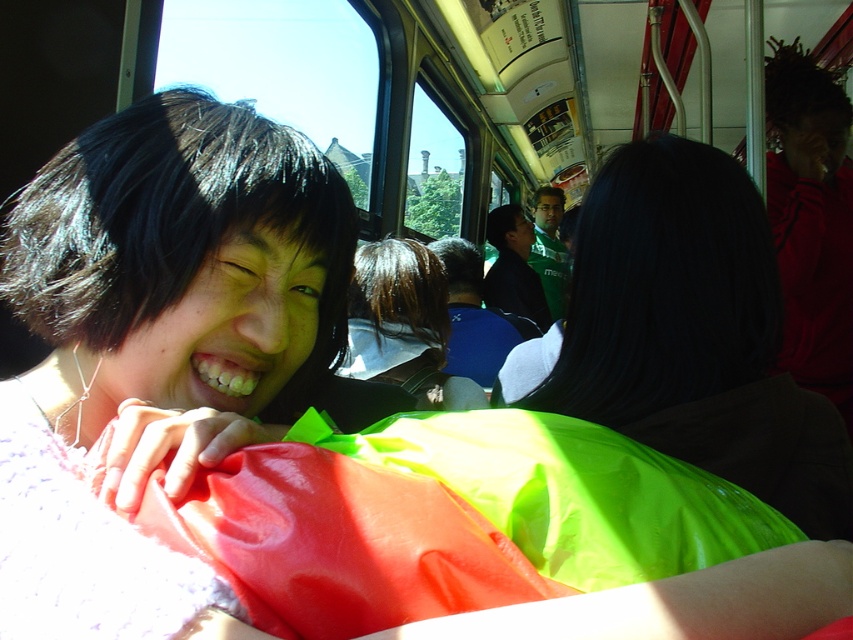
You are a passenger on a bus and you want to place your neon green fabric at center on the seat. Where exactly should you place it?

You should place the neon green fabric at center at point (x=693, y=333) on the seat.

You are a passenger on a bus and you see the neon green fabric at center and the blue fabric at center. Which fabric is positioned higher up?

The neon green fabric at center is located above the blue fabric at center, so it is positioned higher up.

Looking at this image, based on the scene description, where exactly is the shiny black hair at center located in terms of coordinates?

The shiny black hair at center is located at coordinates point (403, 324).